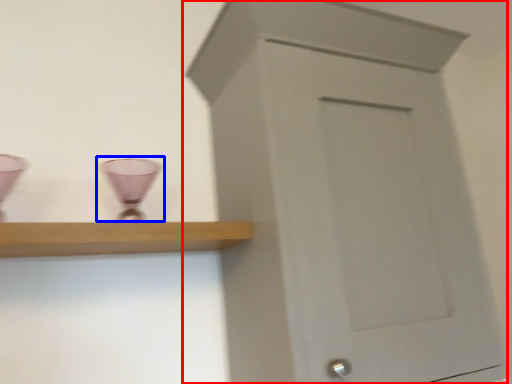
Question: Which object is closer to the camera taking this photo, cupboard (highlighted by a red box) or candle holder (highlighted by a blue box)?

Choices:
 (A) cupboard
 (B) candle holder

Answer: (A)